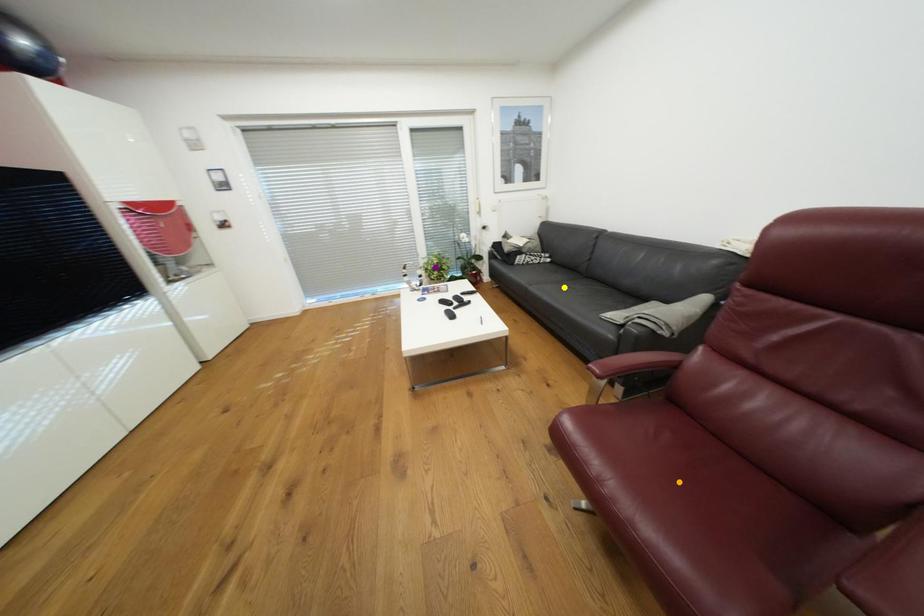
From the picture: Order these from farthest to nearest:
- purple point
- yellow point
- orange point

purple point < yellow point < orange point